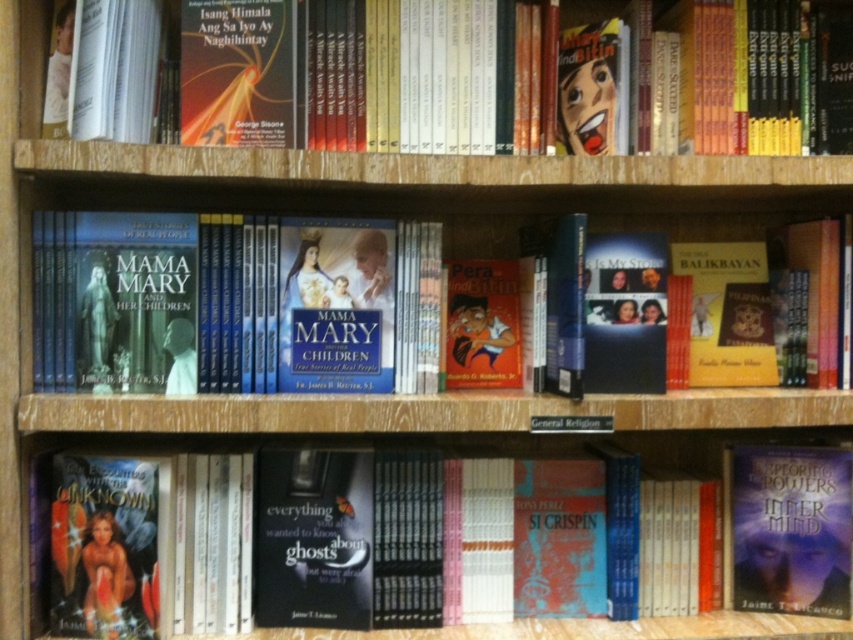
You are organizing books on a shelf and notice two books at the center of the shelf. The hardcover book at center and the matte orange book at center. Which one is placed higher?

The hardcover book at center is located above the matte orange book at center, so it is placed higher.

You are organizing books on a wooden bookshelf. You have two books to place next to each other. The matte hardcover book at center and the hardcover book at lower left. Which book should you place first if you want to arrange them from smallest to largest?

The matte hardcover book at center should be placed first because it is smaller than the hardcover book at lower left.

You are a librarian organizing books on a shelf. You have a matte hardcover book at center and a hardcover book at lower left. You need to place a new book that is 20 centimeters wide. Can both books fit side by side with the new book between them?

The matte hardcover book at center and hardcover book at lower left are 35.34 centimeters apart. Since the new book is 20 centimeters wide, there is insufficient space to fit it between them as 20 cm exceeds the available 35.34 cm gap.